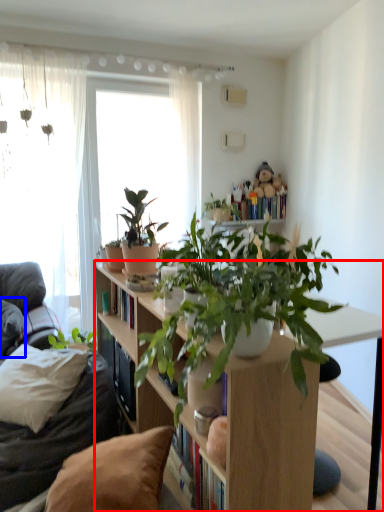
Question: Which of the following is the farthest to the observer, bookcase (highlighted by a red box) or pillow (highlighted by a blue box)?

Choices:
 (A) bookcase
 (B) pillow

Answer: (B)